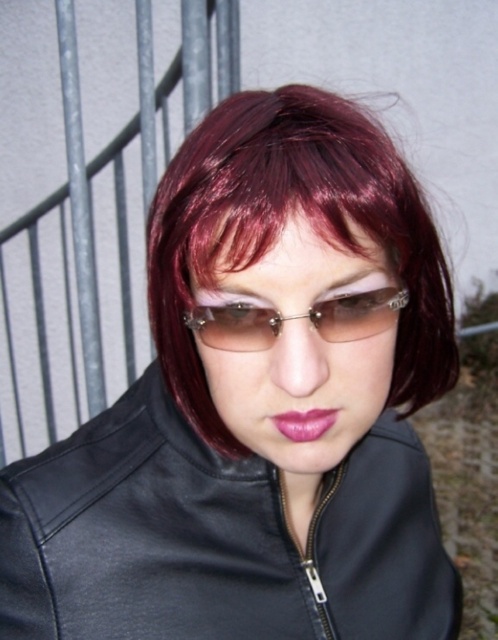
Question: Estimate the real-world distances between objects in this image. Which object is closer to the black leather jacket at center?

Choices:
 (A) pink glossy lips at center
 (B) shiny burgundy wig at center

Answer: (B)

Question: Is shiny burgundy wig at center in front of clear plastic glasses at center?

Choices:
 (A) yes
 (B) no

Answer: (A)

Question: Which is farther from the pink glossy lips at center?

Choices:
 (A) shiny burgundy wig at center
 (B) black leather jacket at center

Answer: (B)

Question: Is black leather jacket at center behind pink glossy lips at center?

Choices:
 (A) no
 (B) yes

Answer: (B)

Question: Which point is farther from the camera taking this photo?

Choices:
 (A) (220, 244)
 (B) (115, 589)

Answer: (B)

Question: In this image, where is black leather jacket at center located relative to pink glossy lips at center?

Choices:
 (A) right
 (B) left

Answer: (B)